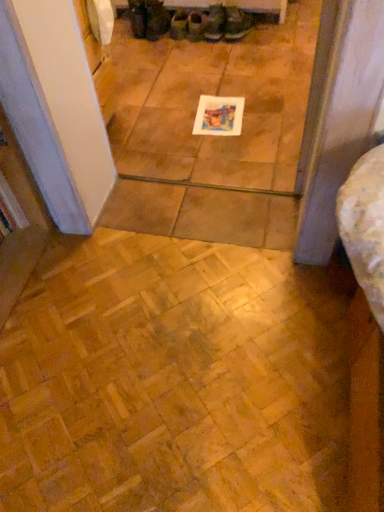
Locate an element on the screen. The width and height of the screenshot is (384, 512). free space between white paper at center and green fabric shoe at upper center, positioned as the 1th footwear in right-to-left order is located at coordinates (236, 71).